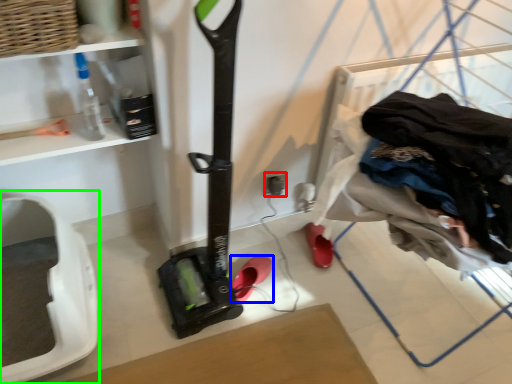
Question: Considering the real-world distances, which object is closest to electric outlet (highlighted by a red box)? footwear (highlighted by a blue box) or appliance (highlighted by a green box).

Choices:
 (A) footwear
 (B) appliance

Answer: (A)